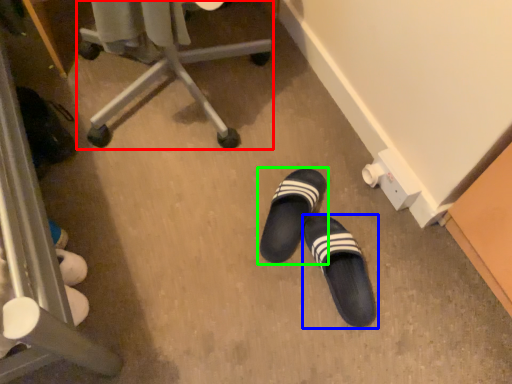
Question: Based on their relative distances, which object is farther from furniture (highlighted by a red box)? Choose from footwear (highlighted by a blue box) and footwear (highlighted by a green box).

Choices:
 (A) footwear
 (B) footwear

Answer: (A)